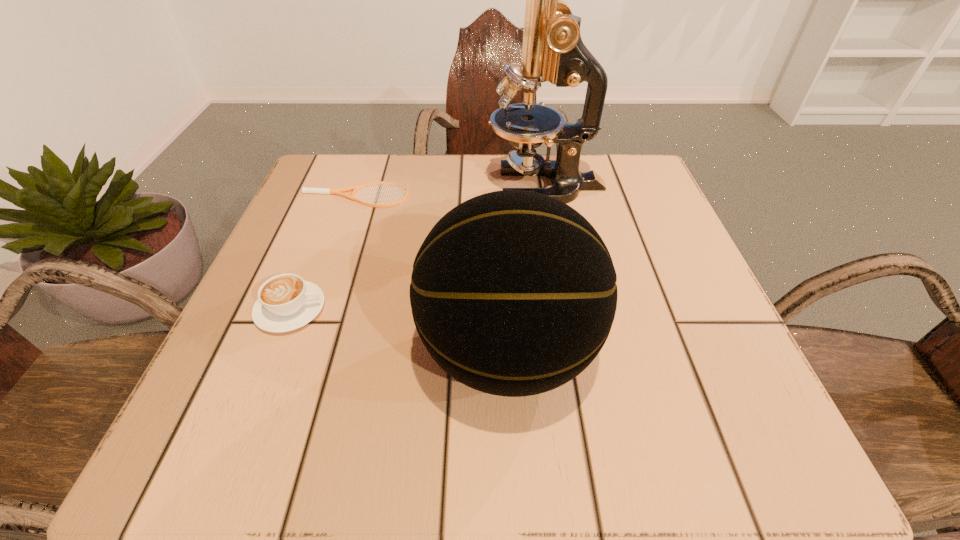
Find the location of `microscope that is at the far edge`. microscope that is at the far edge is located at coordinates (552, 49).

This screenshot has height=540, width=960. I want to click on tennis racket present at the far edge, so click(x=331, y=191).

Where is `object that is at the near edge`? object that is at the near edge is located at coordinates (513, 293).

The width and height of the screenshot is (960, 540). In order to click on cappuccino situated at the left edge in this screenshot , I will do `click(286, 302)`.

Find the location of `tennis racket situated at the left edge`. tennis racket situated at the left edge is located at coordinates (331, 191).

Identify the location of object situated at the right edge. (552, 49).

Find the location of a particular element. The height and width of the screenshot is (540, 960). object that is at the far left corner is located at coordinates (331, 191).

Where is `object at the far right corner`? object at the far right corner is located at coordinates (552, 49).

In the image, there is a desktop. Find the location of `free space at the far edge`. free space at the far edge is located at coordinates (447, 153).

Find the location of a particular element. vacant space at the left edge of the desktop is located at coordinates (361, 231).